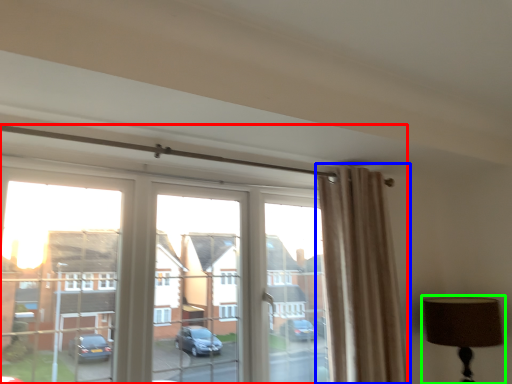
Question: Considering the real-world distances, which object is closest to window (highlighted by a red box)? curtain (highlighted by a blue box) or table lamp (highlighted by a green box).

Choices:
 (A) curtain
 (B) table lamp

Answer: (A)